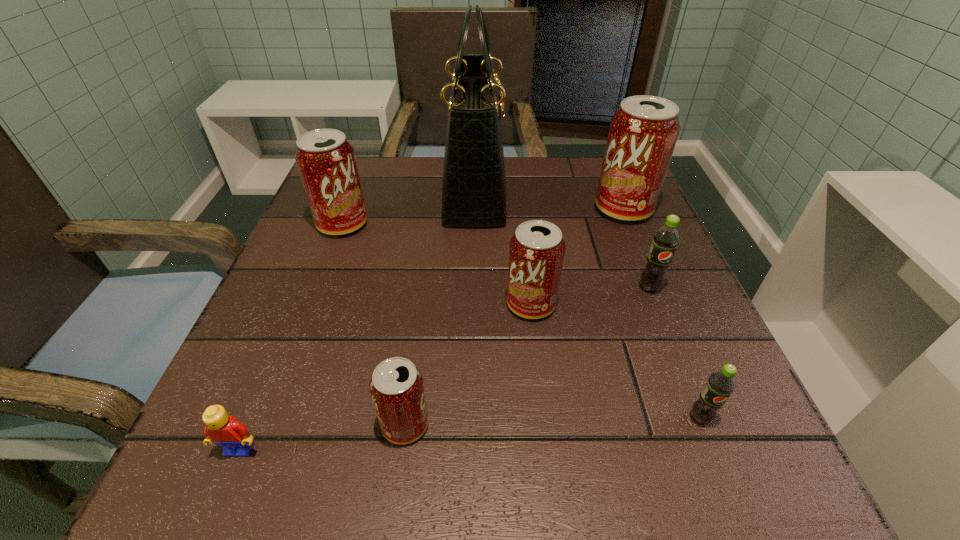
At what (x,y) coordinates should I click in order to perform the action: click on blank space at the left edge of the desktop. Please return your answer as a coordinate pair (x, y). The image size is (960, 540). Looking at the image, I should click on (319, 280).

Identify the location of free space at the right edge. Image resolution: width=960 pixels, height=540 pixels. (612, 249).

The width and height of the screenshot is (960, 540). In order to click on blank space at the far left corner of the desktop in this screenshot , I will do `click(366, 181)`.

Identify the location of vacant space at the far right corner of the desktop. The image size is (960, 540). (575, 170).

Where is `free space between the smaller green soda and the shortest object`? The image size is (960, 540). free space between the smaller green soda and the shortest object is located at coordinates (470, 434).

At what (x,y) coordinates should I click in order to perform the action: click on free space between the farther green soda and the third smallest red soda can. Please return your answer as a coordinate pair (x, y). Looking at the image, I should click on (496, 256).

Locate an element on the screen. vacant space in between the biggest red soda can and the Lego is located at coordinates [x=432, y=329].

Where is `free space between the nearest red soda can and the bigger green soda`? The height and width of the screenshot is (540, 960). free space between the nearest red soda can and the bigger green soda is located at coordinates (527, 356).

At what (x,y) coordinates should I click in order to perform the action: click on vacant space that's between the third red soda can from left to right and the smallest red soda can. Please return your answer as a coordinate pair (x, y). This screenshot has height=540, width=960. Looking at the image, I should click on (468, 364).

Locate an element on the screen. This screenshot has width=960, height=540. free space that is in between the leftmost red soda can and the third red soda can from left to right is located at coordinates (437, 264).